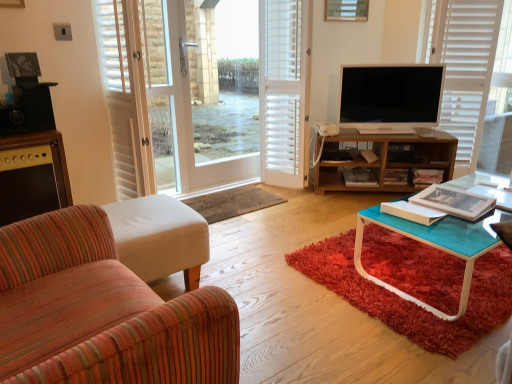
Question: Is striped fabric armchair at left, which is counted as the first chair, starting from the back, spatially inside matte black speaker at left, or outside of it?

Choices:
 (A) inside
 (B) outside

Answer: (B)

Question: Visually, is striped fabric armchair at left, positioned as the 2th chair in front-to-back order, positioned to the left or to the right of matte black speaker at left?

Choices:
 (A) right
 (B) left

Answer: (A)

Question: Which of these objects is positioned farthest from the wooden shelf at center?

Choices:
 (A) shaggy red rug at lower right
 (B) white wood screen door at center
 (C) rug at center
 (D) white wooden blind at upper right
 (E) white wooden shutter at center

Answer: (B)

Question: Estimate the real-world distances between objects in this image. Which object is farther from the matte black speaker at left?

Choices:
 (A) wooden picture frame at upper center
 (B) white wooden shutter at center
 (C) white wooden blind at upper right
 (D) wooden shelf at center
 (E) rug at center

Answer: (C)